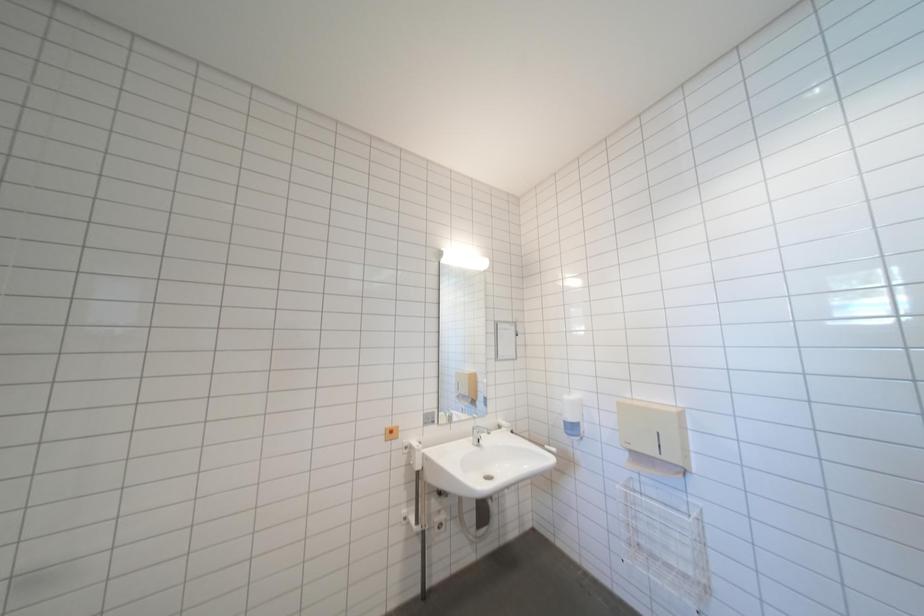
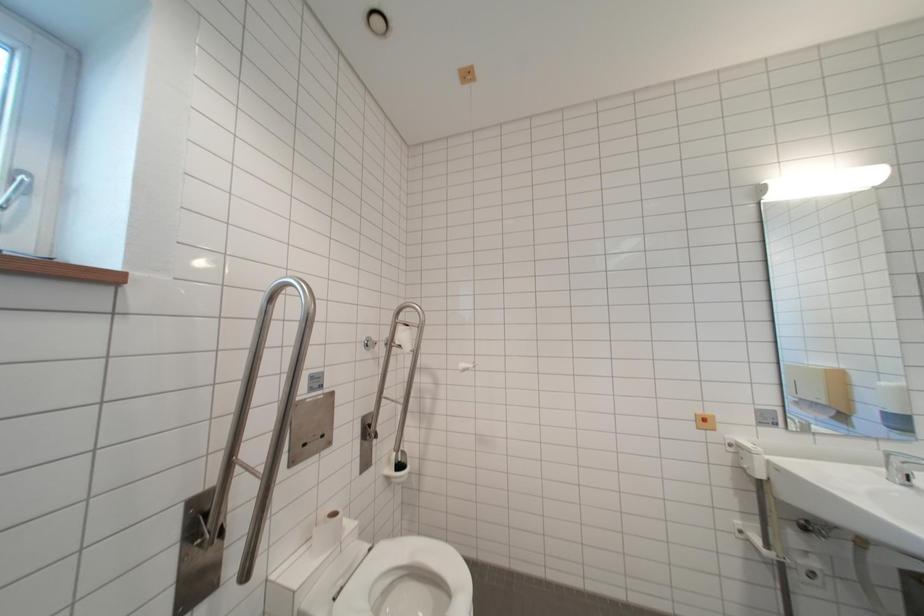
Question: The camera is either moving clockwise (left) or counter-clockwise (right) around the object. The first image is from the beginning of the video and the second image is from the end. Is the camera moving left or right when shooting the video?

Choices:
 (A) Left
 (B) Right

Answer: (B)